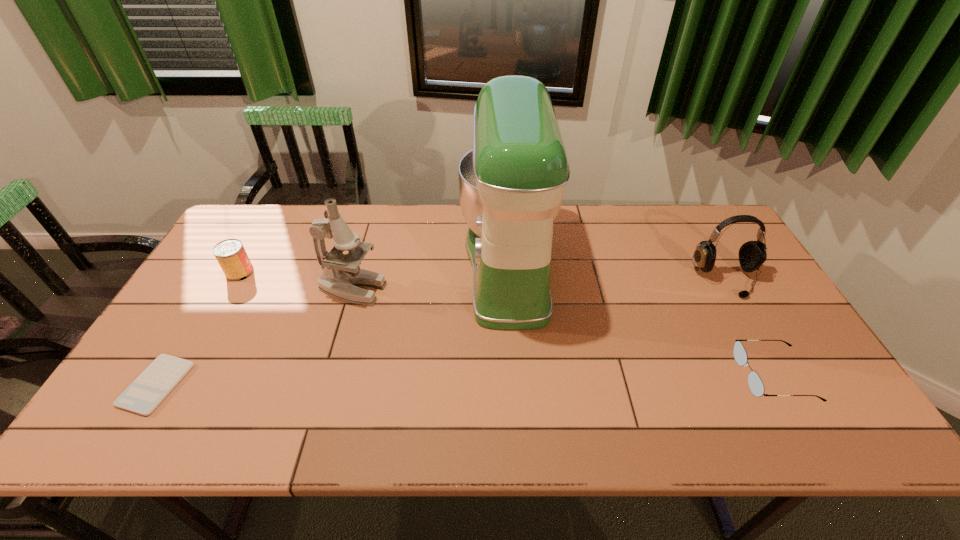
This screenshot has width=960, height=540. I want to click on mixer, so click(511, 184).

The width and height of the screenshot is (960, 540). I want to click on the tallest object, so click(x=511, y=184).

Image resolution: width=960 pixels, height=540 pixels. What are the coordinates of `microscope` in the screenshot? It's located at (341, 274).

This screenshot has height=540, width=960. Identify the location of the fourth object from right to left. [x=341, y=274].

Where is `headset`? The width and height of the screenshot is (960, 540). headset is located at coordinates (752, 254).

Where is `the fourth tallest object`? The width and height of the screenshot is (960, 540). the fourth tallest object is located at coordinates (230, 254).

This screenshot has height=540, width=960. I want to click on the second shortest object, so click(x=756, y=386).

What are the coordinates of `the shortest object` in the screenshot? It's located at (151, 387).

Locate an element on the screen. The width and height of the screenshot is (960, 540). vacant space located 0.360m on the controls of the mixer is located at coordinates (343, 266).

Image resolution: width=960 pixels, height=540 pixels. What are the coordinates of `blank space located 0.060m on the controls of the mixer` in the screenshot? It's located at (441, 266).